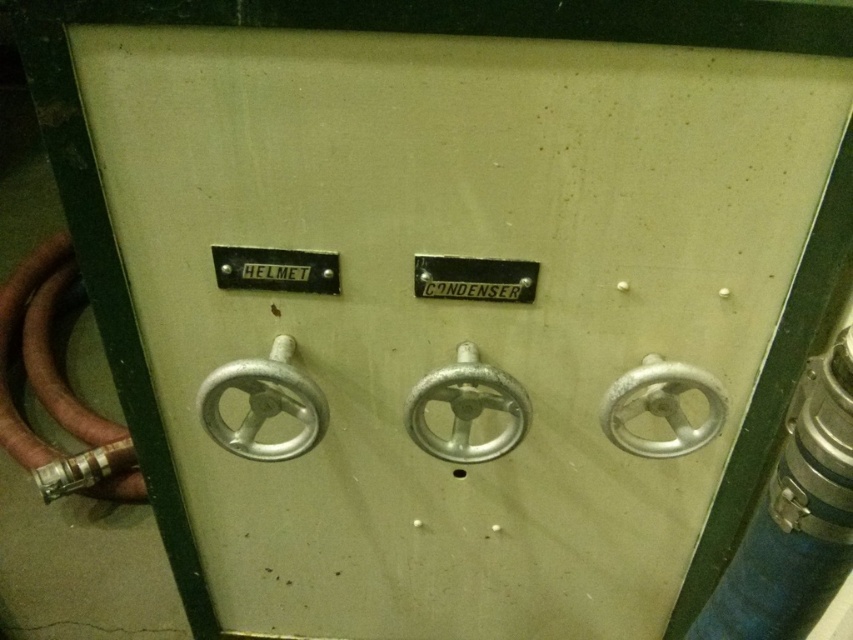
Question: Which point is closer to the camera taking this photo?

Choices:
 (A) (32, 464)
 (B) (312, 273)
 (C) (825, 355)

Answer: (C)

Question: Which point is farther to the camera?

Choices:
 (A) (763, 538)
 (B) (80, 477)
 (C) (461, 406)
 (D) (80, 424)

Answer: (D)

Question: Is brown rubber hose at left thinner than silver metallic valve at center?

Choices:
 (A) no
 (B) yes

Answer: (A)

Question: Can you confirm if metallic silver valve at right is smaller than brushed metal valve at lower left?

Choices:
 (A) yes
 (B) no

Answer: (A)

Question: Among these objects, which one is farthest from the camera?

Choices:
 (A) brushed metal valve at lower left
 (B) brown rubber hose at left
 (C) silver metallic valve at center
 (D) metallic silver valve at right

Answer: (B)

Question: Can you confirm if silver metallic pipe at right is positioned to the right of metallic silver valve at right?

Choices:
 (A) no
 (B) yes

Answer: (B)